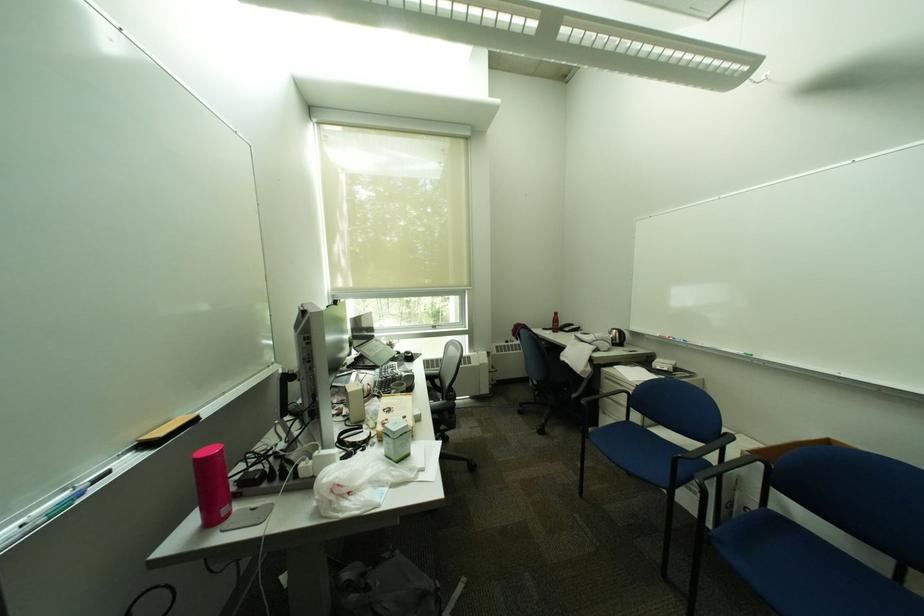
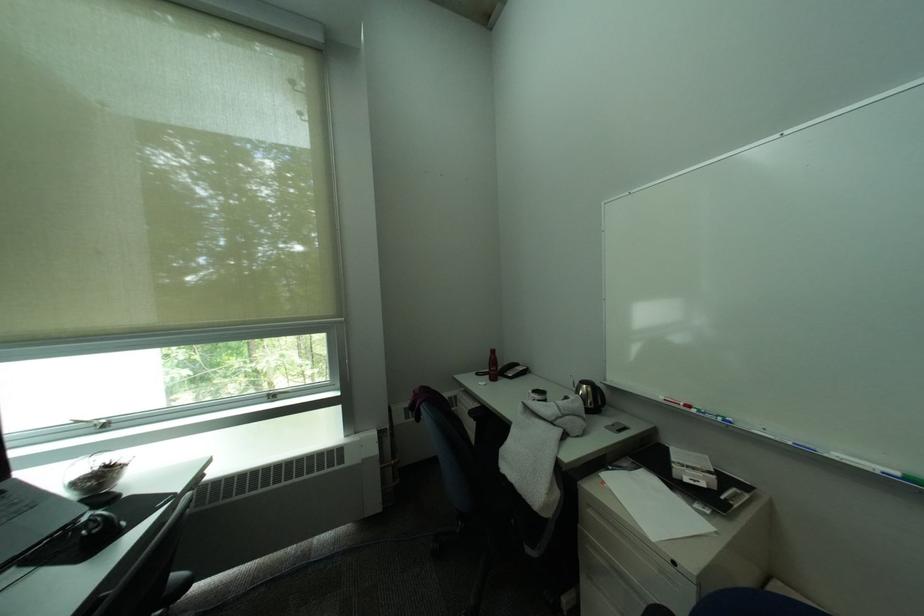
Locate, in the second image, the point that corresponds to point (420, 355) in the first image.

(106, 528)